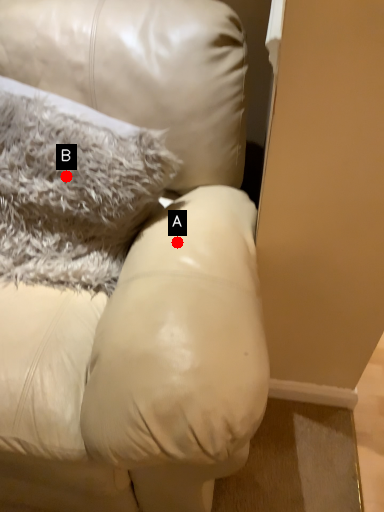
Question: Two points are circled on the image, labeled by A and B beside each circle. Which point appears farthest from the camera in this image?

Choices:
 (A) A is further
 (B) B is further

Answer: (B)